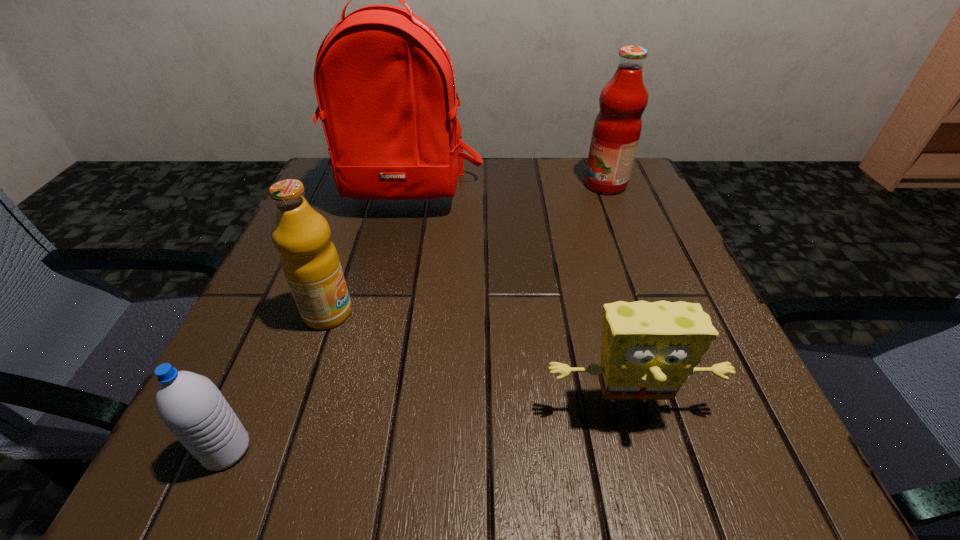
This screenshot has width=960, height=540. What are the coordinates of `the tallest object` in the screenshot? It's located at (385, 85).

This screenshot has height=540, width=960. I want to click on the right fruit juice, so click(x=617, y=128).

At what (x,y) coordinates should I click in order to perform the action: click on the taller fruit juice. Please return your answer as a coordinate pair (x, y). This screenshot has width=960, height=540. Looking at the image, I should click on (617, 128).

Locate an element on the screen. the left fruit juice is located at coordinates (310, 262).

The image size is (960, 540). Find the location of `the third shortest object`. the third shortest object is located at coordinates (310, 262).

The width and height of the screenshot is (960, 540). What are the coordinates of `sponge` in the screenshot? It's located at (648, 350).

At what (x,y) coordinates should I click in order to perform the action: click on water bottle. Please return your answer as a coordinate pair (x, y). The height and width of the screenshot is (540, 960). Looking at the image, I should click on (190, 405).

Locate an element on the screen. The height and width of the screenshot is (540, 960). blank space located 0.120m on the main compartment of the tallest object is located at coordinates (391, 259).

Where is `blank area located on the front label of the second tallest object`? blank area located on the front label of the second tallest object is located at coordinates (537, 185).

The height and width of the screenshot is (540, 960). I want to click on vacant position located 0.320m on the front label of the second tallest object, so click(x=447, y=185).